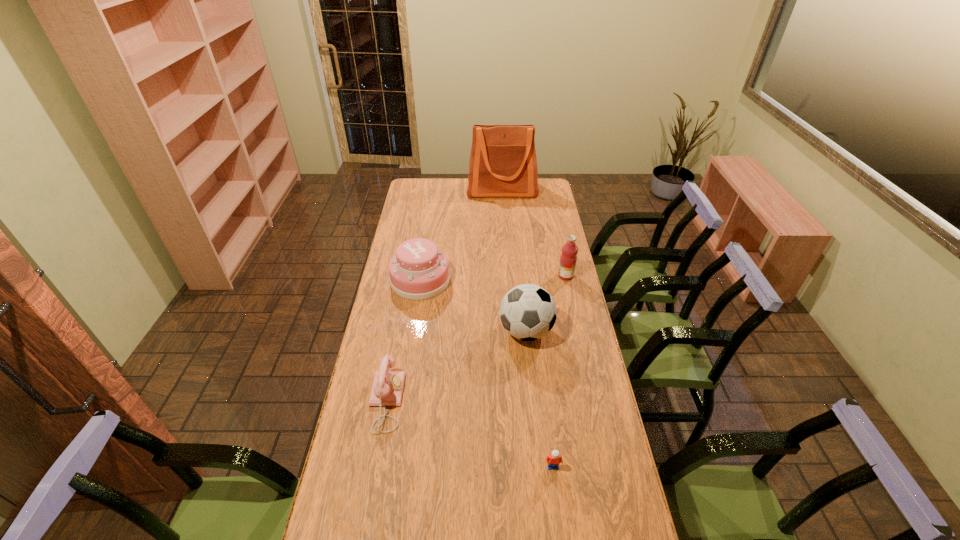
I want to click on the farthest object, so click(x=503, y=163).

Image resolution: width=960 pixels, height=540 pixels. Find the location of `shopping bag`. shopping bag is located at coordinates (503, 163).

Locate an element on the screen. the fourth farthest object is located at coordinates (528, 312).

This screenshot has height=540, width=960. I want to click on fruit juice, so click(x=568, y=258).

Find the location of `birthday cake`. birthday cake is located at coordinates (418, 271).

This screenshot has height=540, width=960. What are the coordinates of `the fifth farthest object` in the screenshot? It's located at (387, 388).

At what (x,y) coordinates should I click in order to perform the action: click on the fifth tallest object. Please return your answer as a coordinate pair (x, y). Looking at the image, I should click on (387, 388).

You are a GUI agent. You are given a task and a screenshot of the screen. Output one action in this format:
    pyautogui.click(x=<x>, y=<y>)
    Task: Click on the Lego
    This screenshot has height=540, width=960.
    Given the screenshot: What is the action you would take?
    click(x=553, y=460)

Where is `the shortest object`? the shortest object is located at coordinates (553, 460).

Where is `vacant space located 0.180m on the front pocket of the shopping bag`? Image resolution: width=960 pixels, height=540 pixels. vacant space located 0.180m on the front pocket of the shopping bag is located at coordinates (504, 219).